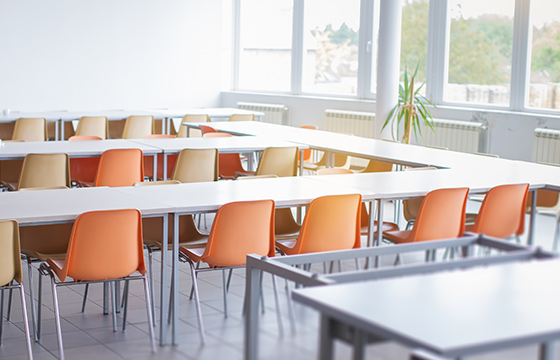
The image size is (560, 360). I want to click on radiators, so click(x=267, y=107), click(x=348, y=117), click(x=470, y=130), click(x=547, y=139).